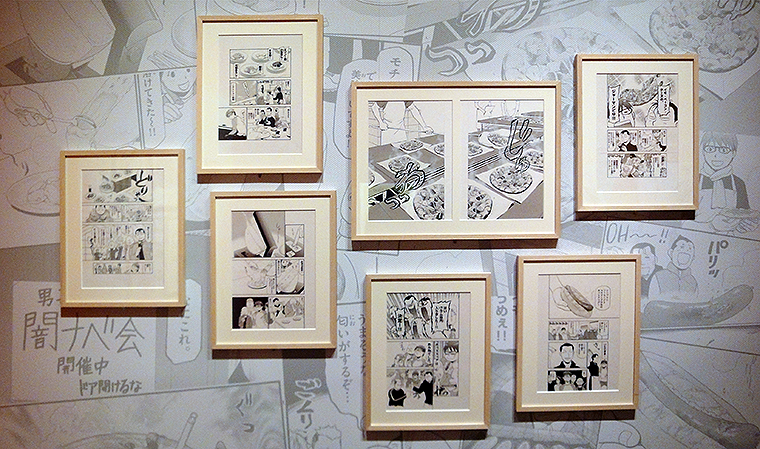
Locate an element on the screen. The image size is (760, 449). frames is located at coordinates (518, 383), (489, 373), (337, 285), (179, 219), (203, 145), (350, 162), (583, 162).